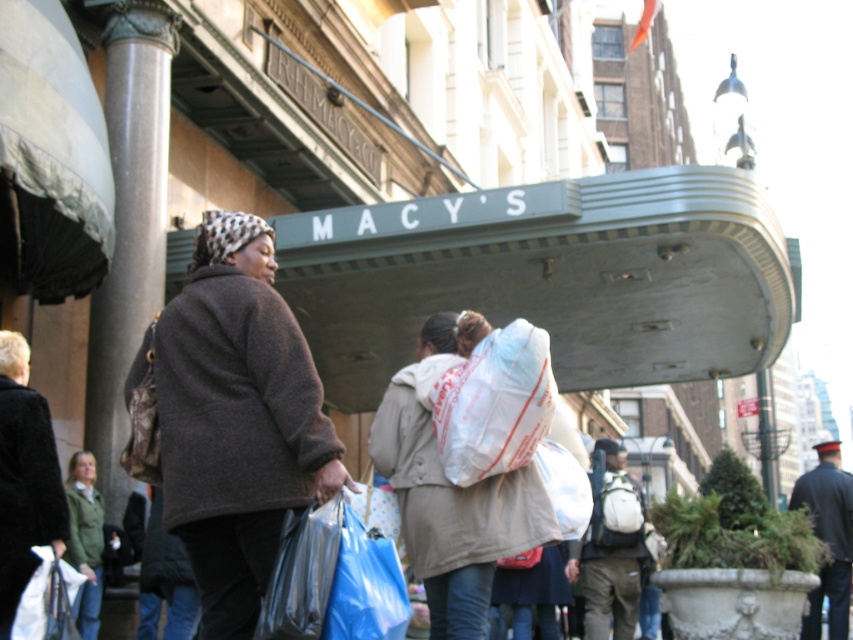
Looking at this image, you are a pedestrian walking on the street and see the shiny plastic bag at lower center and the translucent plastic bag at lower left. Which bag is located more to the right side?

The shiny plastic bag at lower center is positioned on the right side of the translucent plastic bag at lower left, so it is more to the right.

You are standing at the Macy store entrance and want to walk towards the point that is closer to you. Which point should you head towards, point (520, 500) or point (45, 588)?

You should head towards point (45, 588) because it is closer to you than point (520, 500).